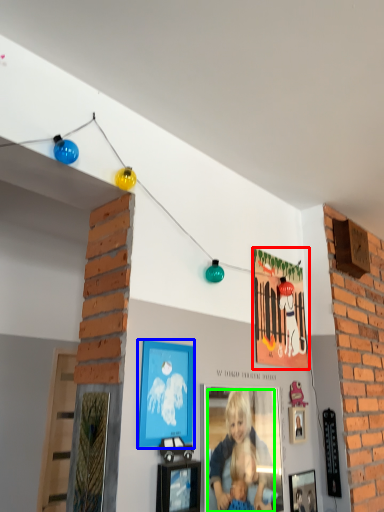
Question: Which object is positioned farthest from picture frame (highlighted by a red box)? Select from picture frame (highlighted by a blue box) and person (highlighted by a green box).

Choices:
 (A) picture frame
 (B) person

Answer: (A)